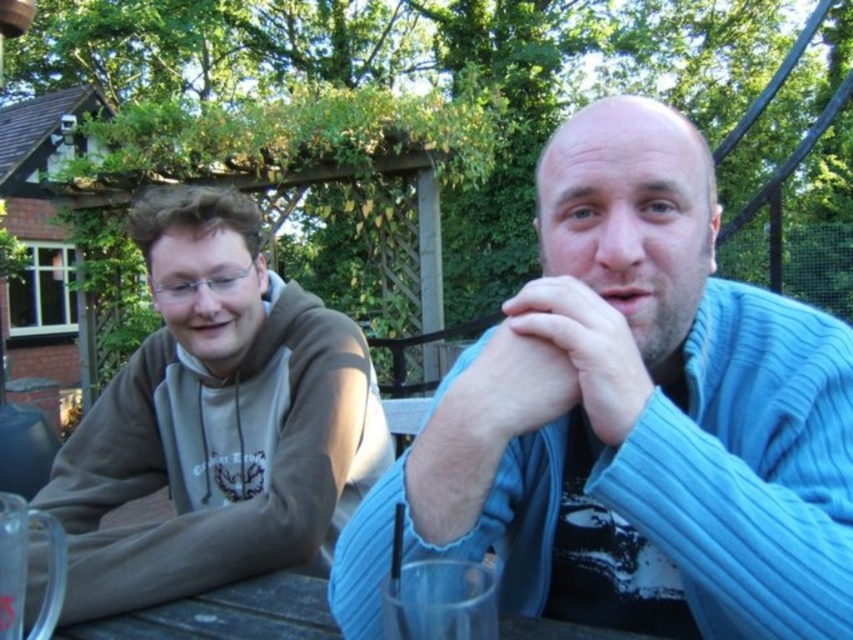
Measure the distance between point [286,472] and camera.

A distance of 4.20 feet exists between point [286,472] and camera.

Can you confirm if gray hoodie at left is taller than wooden table at lower center?

Indeed, gray hoodie at left has a greater height compared to wooden table at lower center.

Measure the distance between gray hoodie at left and camera.

Answer: A distance of 37.90 inches exists between gray hoodie at left and camera.

This screenshot has height=640, width=853. In order to click on gray hoodie at left in this screenshot , I will do `click(218, 420)`.

Does blue ribbed sweater at center appear under gray hoodie at left?

Actually, blue ribbed sweater at center is above gray hoodie at left.

Does blue ribbed sweater at center have a greater height compared to gray hoodie at left?

In fact, blue ribbed sweater at center may be shorter than gray hoodie at left.

Is point (762, 454) less distant than point (263, 444)?

Yes, point (762, 454) is closer to viewer.

At what (x,y) coordinates should I click in order to perform the action: click on blue ribbed sweater at center. Please return your answer as a coordinate pair (x, y). Looking at the image, I should click on (631, 419).

Does blue ribbed sweater at center appear on the left side of wooden table at lower center?

No, blue ribbed sweater at center is not to the left of wooden table at lower center.

Does blue ribbed sweater at center appear over wooden table at lower center?

Yes, blue ribbed sweater at center is above wooden table at lower center.

You are a GUI agent. You are given a task and a screenshot of the screen. Output one action in this format:
    pyautogui.click(x=<x>, y=<y>)
    Task: Click on the blue ribbed sweater at center
    
    Given the screenshot: What is the action you would take?
    pyautogui.click(x=631, y=419)

In order to click on blue ribbed sweater at center in this screenshot , I will do `click(631, 419)`.